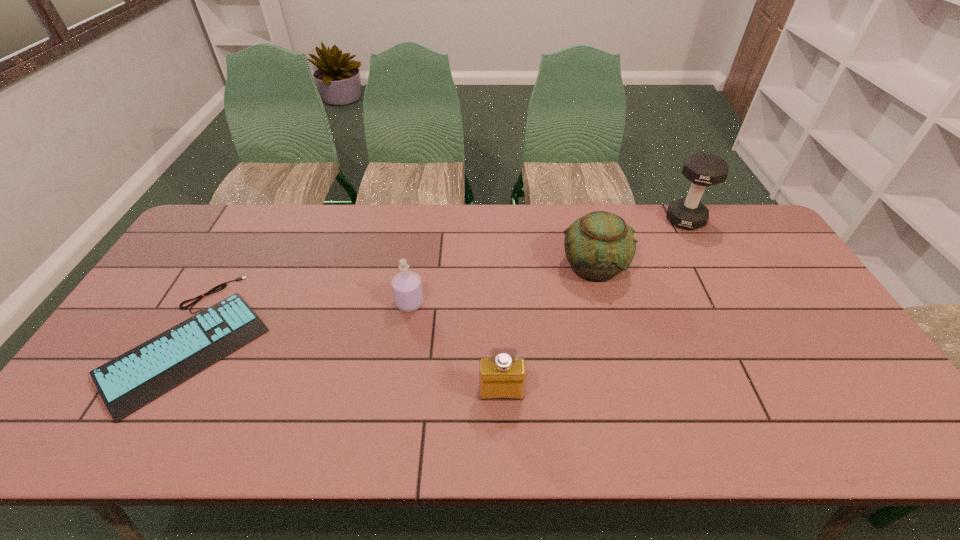
Find the location of a particular element. This screenshot has width=960, height=540. vacant space that is in between the second object from left to right and the second object from right to left is located at coordinates (502, 285).

At what (x,y) coordinates should I click in order to perform the action: click on vacant point located between the right perfume and the left perfume. Please return your answer as a coordinate pair (x, y). Looking at the image, I should click on (456, 348).

The image size is (960, 540). Find the location of `the closest object to the shortest object`. the closest object to the shortest object is located at coordinates (407, 288).

Find the location of a particular element. This screenshot has height=540, width=960. object that can be found as the closest to the third object from left to right is located at coordinates (407, 288).

Find the location of a particular element. The width and height of the screenshot is (960, 540). free location that satisfies the following two spatial constraints: 1. on the back side of the farther perfume; 2. on the left side of the second object from right to left is located at coordinates (415, 267).

Where is `blank area in the image that satisfies the following two spatial constraints: 1. on the back side of the farthest object; 2. on the right side of the second object from right to left`? Image resolution: width=960 pixels, height=540 pixels. blank area in the image that satisfies the following two spatial constraints: 1. on the back side of the farthest object; 2. on the right side of the second object from right to left is located at coordinates (582, 220).

The width and height of the screenshot is (960, 540). Find the location of `free spot that satisfies the following two spatial constraints: 1. on the back side of the left perfume; 2. on the right side of the fourth object from left to right`. free spot that satisfies the following two spatial constraints: 1. on the back side of the left perfume; 2. on the right side of the fourth object from left to right is located at coordinates (415, 267).

Locate an element on the screen. This screenshot has height=540, width=960. free space in the image that satisfies the following two spatial constraints: 1. on the back side of the leftmost object; 2. on the right side of the fourth object from right to left is located at coordinates (214, 303).